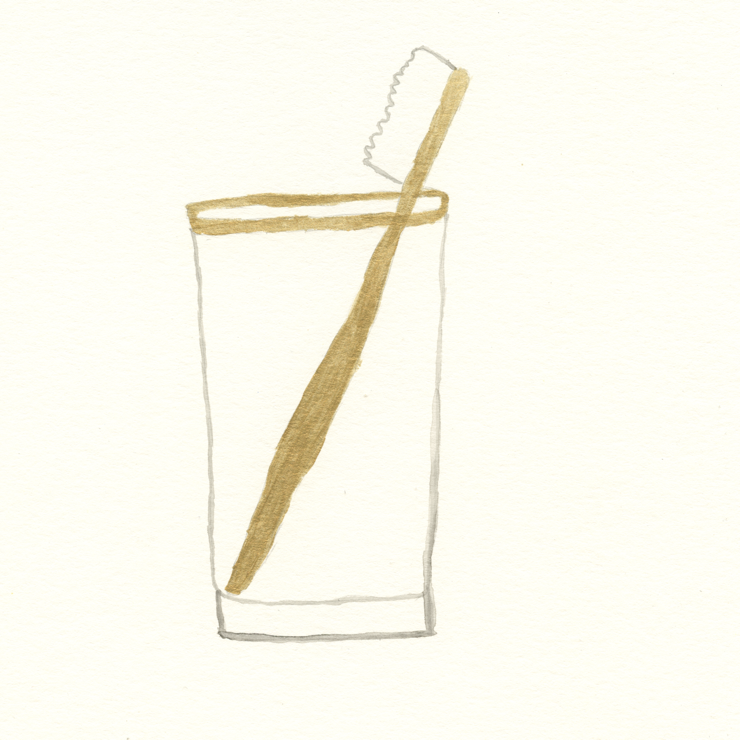
In order to click on toothbrush bristle area in this screenshot , I will do `click(426, 87)`.